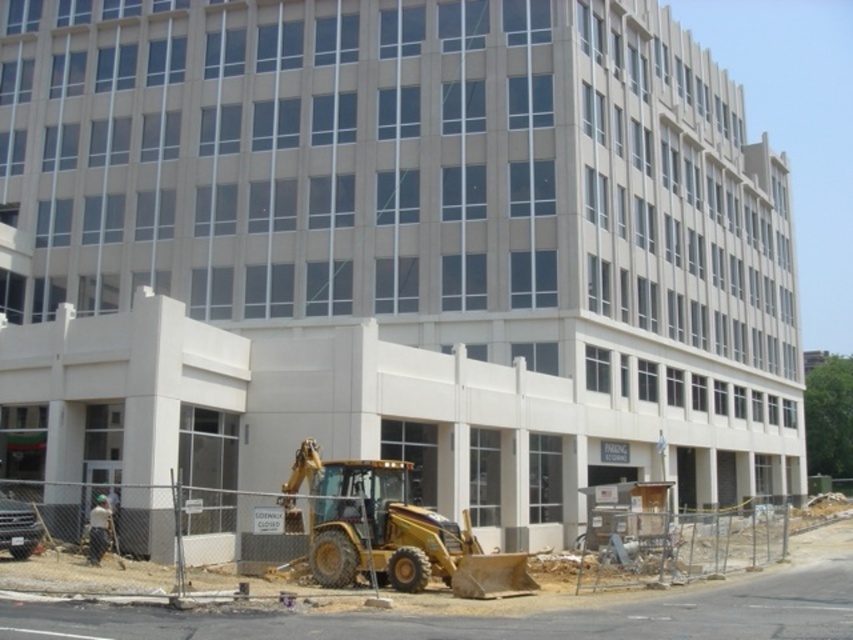
Question: Which object is closer to the camera taking this photo?

Choices:
 (A) white fabric construction worker at lower left
 (B) yellow metallic backhoe at lower center

Answer: (B)

Question: Which point is closer to the camera taking this photo?

Choices:
 (A) (526, 566)
 (B) (93, 515)
 (C) (846, 608)

Answer: (C)

Question: Which point is closer to the camera?

Choices:
 (A) white fabric construction worker at lower left
 (B) yellow metallic excavator at lower center

Answer: (B)

Question: Can you confirm if yellow metallic excavator at lower center is positioned below white fabric construction worker at lower left?

Choices:
 (A) yes
 (B) no

Answer: (B)

Question: Can you confirm if yellow metallic backhoe at lower center is positioned above yellow metallic excavator at lower center?

Choices:
 (A) yes
 (B) no

Answer: (B)

Question: Is yellow metallic backhoe at lower center to the right of white fabric construction worker at lower left from the viewer's perspective?

Choices:
 (A) yes
 (B) no

Answer: (A)